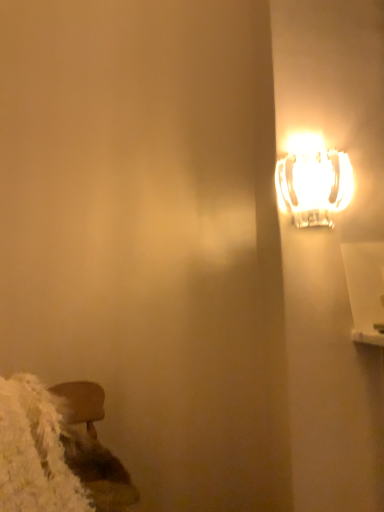
Locate an element on the screen. The height and width of the screenshot is (512, 384). wooden stool at lower left is located at coordinates (34, 452).

In the scene shown: Measure the distance between point (79, 508) and camera.

The depth of point (79, 508) is 1.07 meters.

The image size is (384, 512). Describe the element at coordinates (34, 452) in the screenshot. I see `wooden stool at lower left` at that location.

In order to click on translucent glass lamp at upper right in this screenshot , I will do `click(313, 182)`.

In order to face translucent glass lamp at upper right, should I rotate leftwards or rightwards?

You should rotate right by 16.040 degrees.

What do you see at coordinates (313, 182) in the screenshot? This screenshot has height=512, width=384. I see `translucent glass lamp at upper right` at bounding box center [313, 182].

You are a GUI agent. You are given a task and a screenshot of the screen. Output one action in this format:
    pyautogui.click(x=<x>, y=<y>)
    Task: Click on the wooden stool at lower left
    
    Given the screenshot: What is the action you would take?
    pyautogui.click(x=34, y=452)

Is translucent glass lamp at upper right to the left of wooden stool at lower left from the viewer's perspective?

No.

Based on the photo, which object is more forward, translucent glass lamp at upper right or wooden stool at lower left?

wooden stool at lower left.

Between point (303, 186) and point (38, 485), which one is positioned behind?

Point (303, 186)

From the image's perspective, is translucent glass lamp at upper right above or below wooden stool at lower left?

translucent glass lamp at upper right is situated higher than wooden stool at lower left in the image.

From a real-world perspective, between translucent glass lamp at upper right and wooden stool at lower left, who is vertically higher?

translucent glass lamp at upper right, from a real-world perspective.

Is translucent glass lamp at upper right wider than wooden stool at lower left?

No.

From the picture: Between translucent glass lamp at upper right and wooden stool at lower left, which one has more height?

wooden stool at lower left is taller.

Who is smaller, translucent glass lamp at upper right or wooden stool at lower left?

Smaller between the two is translucent glass lamp at upper right.

Could wooden stool at lower left be considered to be inside translucent glass lamp at upper right?

Actually, wooden stool at lower left is outside translucent glass lamp at upper right.

Would you consider translucent glass lamp at upper right to be distant from wooden stool at lower left?

Actually, translucent glass lamp at upper right and wooden stool at lower left are a little close together.

From the picture: Does translucent glass lamp at upper right turn towards wooden stool at lower left?

No.

How many degrees apart are the facing directions of translucent glass lamp at upper right and wooden stool at lower left?

translucent glass lamp at upper right and wooden stool at lower left are facing 63.2 degrees away from each other.

At what (x,y) coordinates should I click in order to perform the action: click on wide that is under the translucent glass lamp at upper right (from a real-world perspective). Please return your answer as a coordinate pair (x, y). Looking at the image, I should click on (34, 452).

Consider the image. Considering the positions of objects wooden stool at lower left and translucent glass lamp at upper right in the image provided, who is more to the right, wooden stool at lower left or translucent glass lamp at upper right?

From the viewer's perspective, translucent glass lamp at upper right appears more on the right side.

Is wooden stool at lower left closer to camera compared to translucent glass lamp at upper right?

Yes, it is.

Which point is more distant from viewer, (64, 501) or (304, 217)?

Point (304, 217)

From the image's perspective, is wooden stool at lower left beneath translucent glass lamp at upper right?

Indeed, from the image's perspective, wooden stool at lower left is shown beneath translucent glass lamp at upper right.

From a real-world perspective, is wooden stool at lower left above or below translucent glass lamp at upper right?

wooden stool at lower left is situated lower than translucent glass lamp at upper right in the real world.

Looking at their sizes, would you say wooden stool at lower left is wider or thinner than translucent glass lamp at upper right?

In the image, wooden stool at lower left appears to be wider than translucent glass lamp at upper right.

Does wooden stool at lower left have a greater height compared to translucent glass lamp at upper right?

Correct, wooden stool at lower left is much taller as translucent glass lamp at upper right.

Considering the relative sizes of wooden stool at lower left and translucent glass lamp at upper right in the image provided, is wooden stool at lower left smaller than translucent glass lamp at upper right?

Incorrect, wooden stool at lower left is not smaller in size than translucent glass lamp at upper right.

Is wooden stool at lower left situated inside translucent glass lamp at upper right or outside?

wooden stool at lower left is not enclosed by translucent glass lamp at upper right.

Is wooden stool at lower left placed right next to translucent glass lamp at upper right?

No, wooden stool at lower left is not next to translucent glass lamp at upper right.

Is wooden stool at lower left oriented towards translucent glass lamp at upper right?

No, wooden stool at lower left is not turned towards translucent glass lamp at upper right.

How many degrees apart are the facing directions of wooden stool at lower left and translucent glass lamp at upper right?

The angle between the facing direction of wooden stool at lower left and the facing direction of translucent glass lamp at upper right is 63.2 degrees.

How much distance is there between wooden stool at lower left and translucent glass lamp at upper right?

wooden stool at lower left and translucent glass lamp at upper right are 35.83 inches apart.

The width and height of the screenshot is (384, 512). I want to click on lamp that appears above the wooden stool at lower left (from a real-world perspective), so click(313, 182).

The width and height of the screenshot is (384, 512). I want to click on lamp on the right side of wooden stool at lower left, so click(313, 182).

In order to click on wide located below the translucent glass lamp at upper right (from the image's perspective) in this screenshot , I will do `click(34, 452)`.